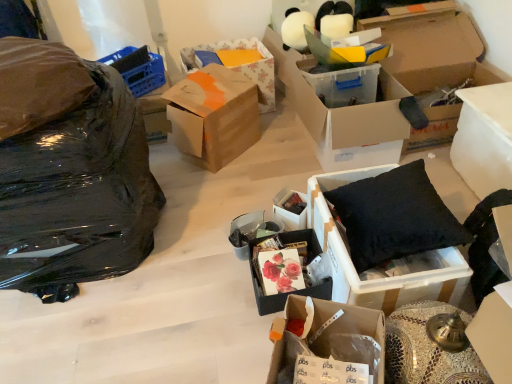
This screenshot has height=384, width=512. I want to click on free space in front of black plastic bag at left, so click(x=86, y=337).